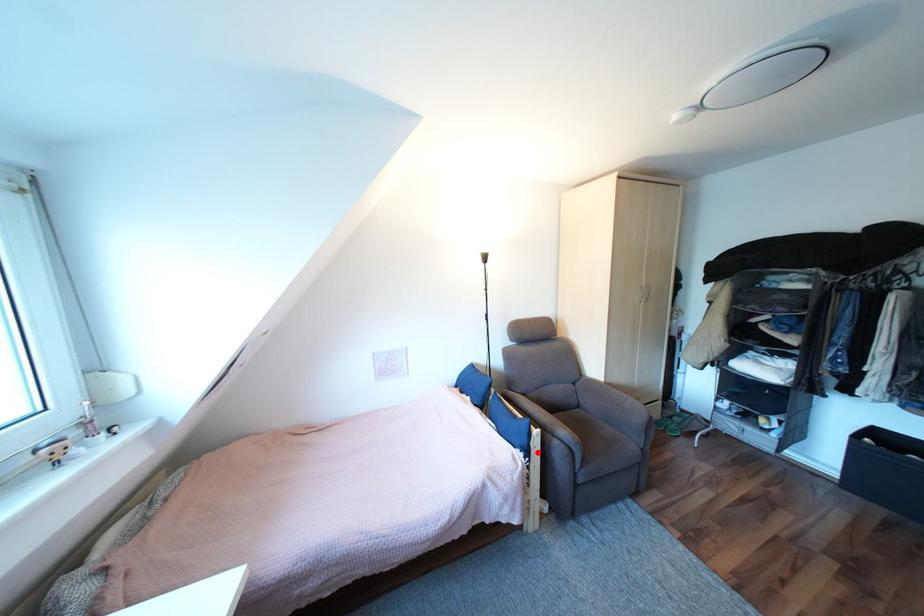
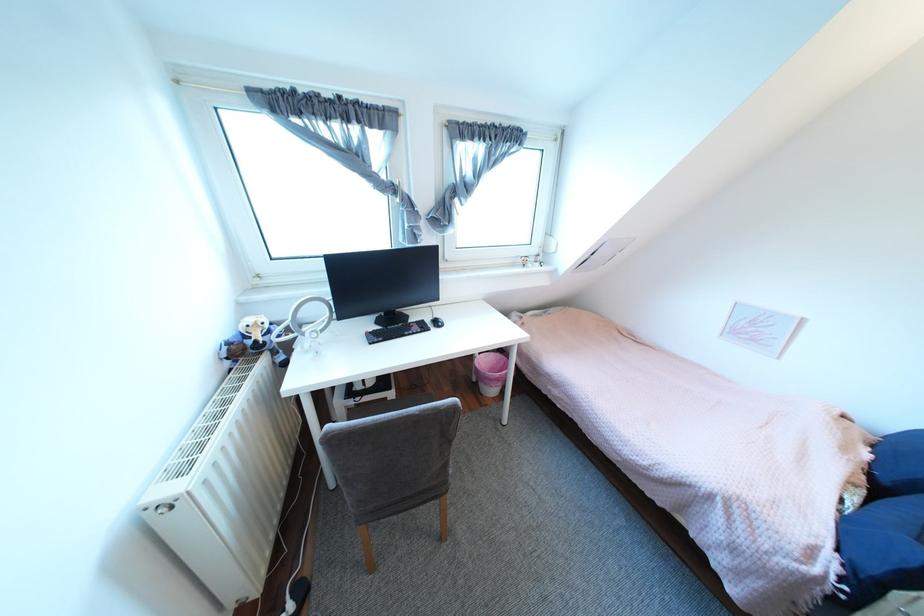
In the second image, find the point that corresponds to the highlighted location in the first image.

(873, 586)